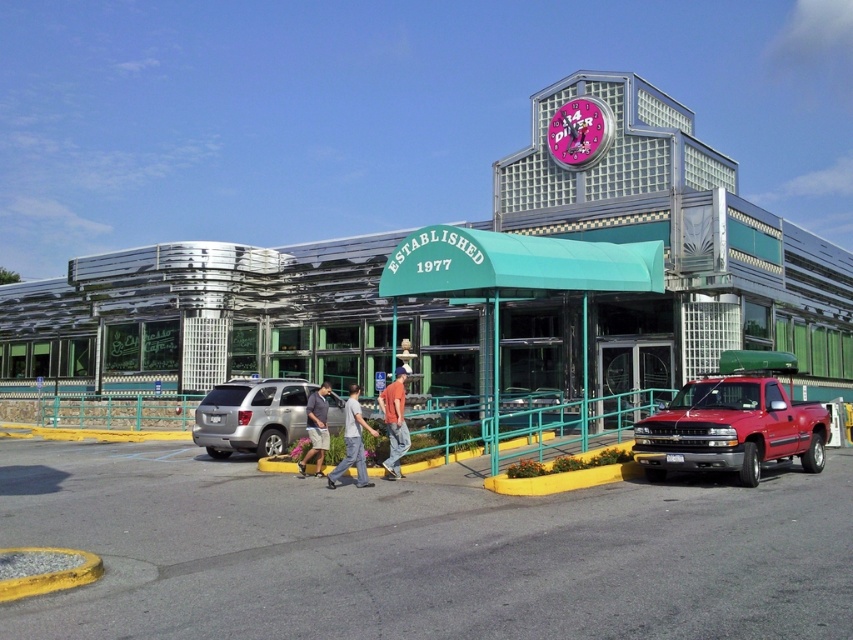
You are standing at the entrance of the diner and want to check if your car is within a safe distance for a fire exit. The fire exit requires a minimum clearance of 50 feet from any vehicle. Is the silver metallic suv at center within this safety zone?

The silver metallic suv at center is 54.88 feet away from the viewer, which exceeds the required 50 feet clearance. Therefore, it is within the safe distance for the fire exit.